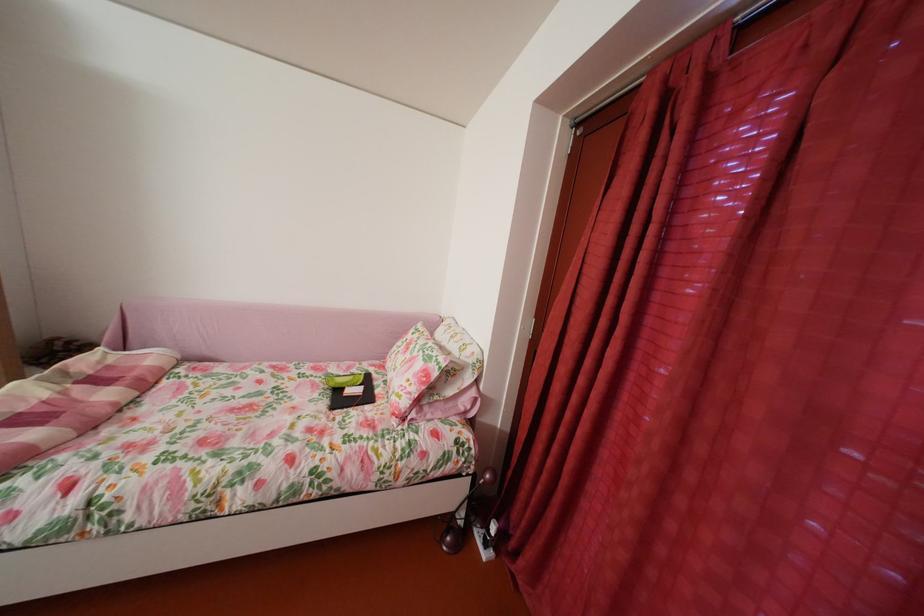
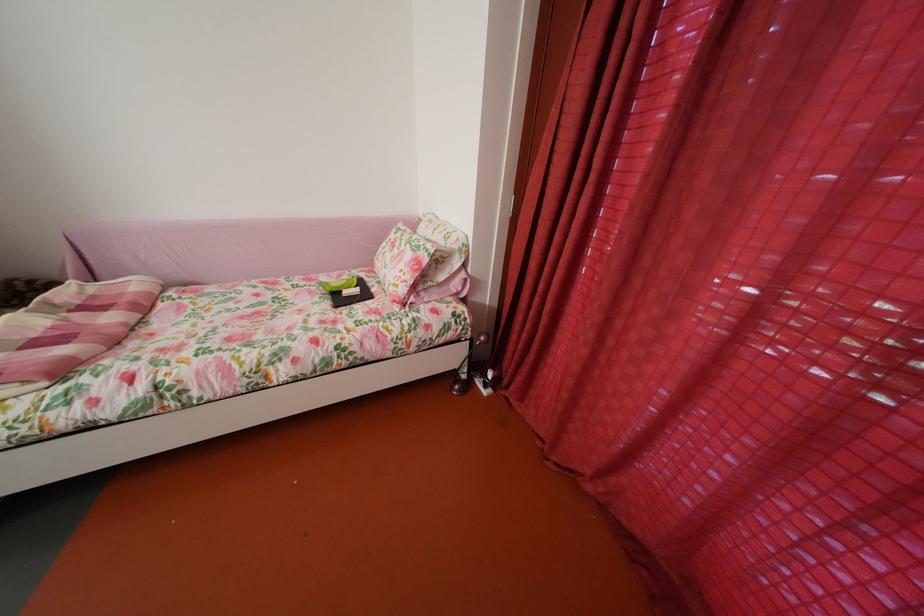
Find the pixel in the second image that matches pixel 431 371 in the first image.

(419, 262)